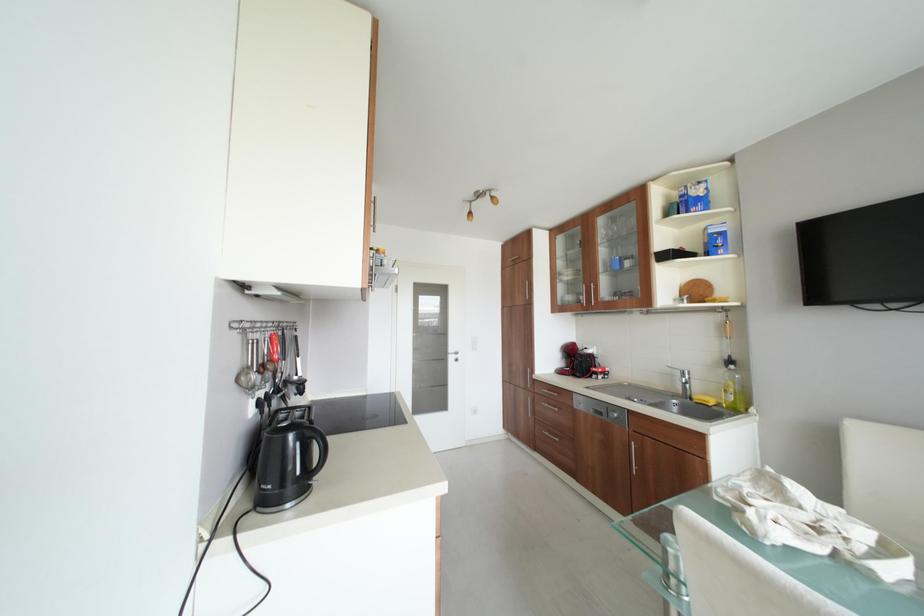
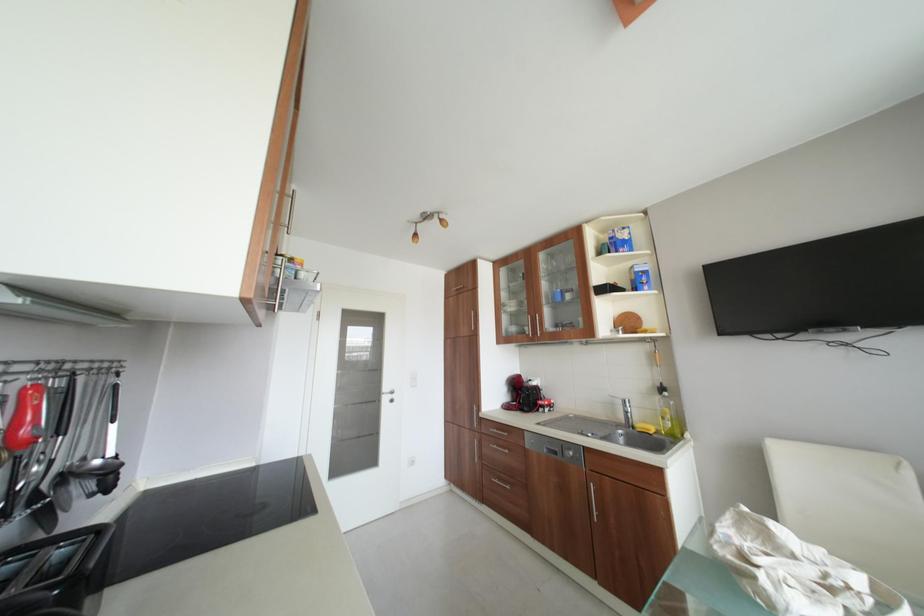
Question: Which direction would the cameraman need to move to produce the second image? Reply with the corresponding letter.

Choices:
 (A) Left
 (B) Right
 (C) Forward
 (D) Backward

Answer: (C)